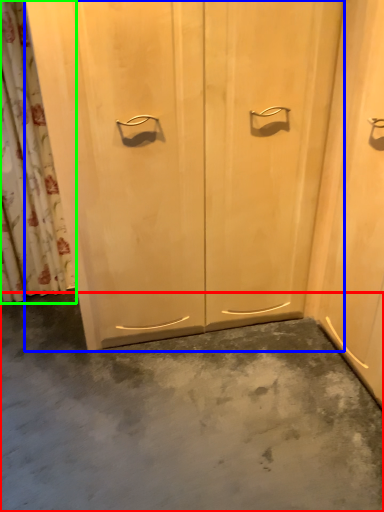
Question: Estimate the real-world distances between objects in this image. Which object is closer to concrete (highlighted by a red box), door (highlighted by a blue box) or shower curtain (highlighted by a green box)?

Choices:
 (A) door
 (B) shower curtain

Answer: (A)